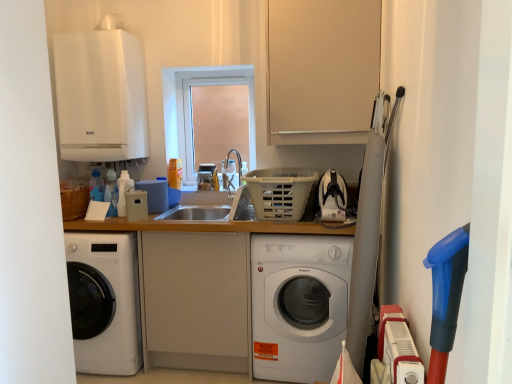
Question: Should I look upward or downward to see white plastic basket at center?

Choices:
 (A) up
 (B) down

Answer: (B)

Question: Is transparent glass window at center positioned with its back to beige plastic speaker at center, arranged as the 3th appliance when viewed from the back?

Choices:
 (A) no
 (B) yes

Answer: (A)

Question: Is transparent glass window at center thinner than beige plastic speaker at center, arranged as the 3th appliance when viewed from the back?

Choices:
 (A) yes
 (B) no

Answer: (A)

Question: Considering the relative sizes of transparent glass window at center and beige plastic speaker at center, which is counted as the first appliance, starting from the bottom, in the image provided, is transparent glass window at center taller than beige plastic speaker at center, which is counted as the first appliance, starting from the bottom,?

Choices:
 (A) no
 (B) yes

Answer: (B)

Question: Can beige plastic speaker at center, which appears as the 2th appliance when viewed from the left, be found inside transparent glass window at center?

Choices:
 (A) yes
 (B) no

Answer: (B)

Question: Considering the relative positions of transparent glass window at center and beige plastic speaker at center, arranged as the 3th appliance when viewed from the back, in the image provided, is transparent glass window at center to the right of beige plastic speaker at center, arranged as the 3th appliance when viewed from the back, from the viewer's perspective?

Choices:
 (A) no
 (B) yes

Answer: (B)

Question: From the image's perspective, would you say transparent glass window at center is positioned over beige plastic speaker at center, arranged as the second appliance when viewed from the right?

Choices:
 (A) no
 (B) yes

Answer: (B)

Question: Is beige plastic speaker at center, which appears as the 2th appliance when viewed from the left, with transparent glass window at center?

Choices:
 (A) yes
 (B) no

Answer: (B)

Question: Does beige plastic speaker at center, arranged as the 3th appliance when viewed from the back, have a lesser width compared to transparent glass window at center?

Choices:
 (A) yes
 (B) no

Answer: (B)

Question: Does beige plastic speaker at center, the 3th appliance viewed from the top, have a greater height compared to transparent glass window at center?

Choices:
 (A) yes
 (B) no

Answer: (B)

Question: Is beige plastic speaker at center, the 3th appliance viewed from the top, looking in the opposite direction of transparent glass window at center?

Choices:
 (A) no
 (B) yes

Answer: (A)

Question: Considering the relative positions of beige plastic speaker at center, arranged as the 3th appliance when viewed from the back, and transparent glass window at center in the image provided, is beige plastic speaker at center, arranged as the 3th appliance when viewed from the back, to the right of transparent glass window at center from the viewer's perspective?

Choices:
 (A) yes
 (B) no

Answer: (B)

Question: From a real-world perspective, does beige plastic speaker at center, which is counted as the first appliance, starting from the bottom, stand above transparent glass window at center?

Choices:
 (A) yes
 (B) no

Answer: (B)

Question: Is transparent glass window at center bigger than wooden counter at center?

Choices:
 (A) yes
 (B) no

Answer: (B)